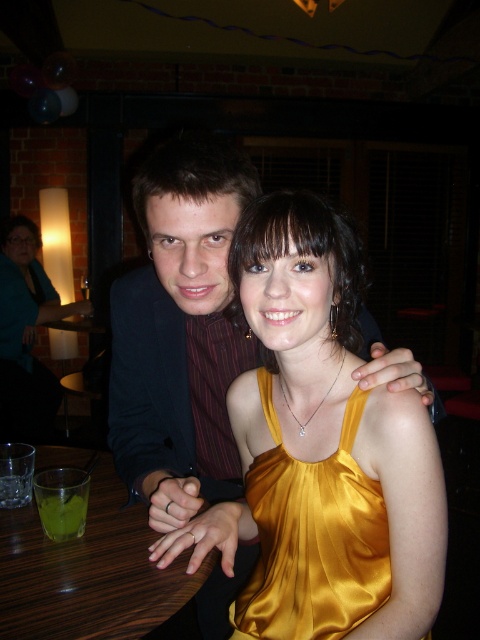
Question: Does gold satin dress at center have a smaller size compared to brown wood table at lower left?

Choices:
 (A) yes
 (B) no

Answer: (A)

Question: Which of the following is the closest to the observer?

Choices:
 (A) (35, 513)
 (B) (308, 637)
 (C) (56, 513)
 (D) (206, 337)

Answer: (B)

Question: Which point is closer to the camera?

Choices:
 (A) (24, 595)
 (B) (49, 410)
 (C) (260, 580)

Answer: (A)

Question: Considering the real-world distances, which object is farthest from the green translucent glass at table left?

Choices:
 (A) brown wood table at lower left
 (B) gold satin dress at center

Answer: (B)

Question: Can you confirm if satin black suit at upper left is smaller than green translucent glass at table left?

Choices:
 (A) no
 (B) yes

Answer: (A)

Question: Can you confirm if satin black suit at upper left is smaller than gold satin dress at center?

Choices:
 (A) no
 (B) yes

Answer: (A)